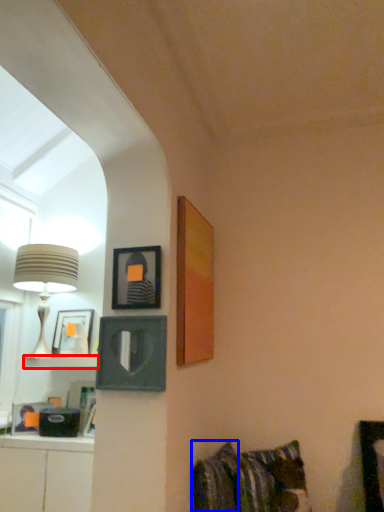
Question: Which object appears farthest to the camera in this image, shelf (highlighted by a red box) or pillow (highlighted by a blue box)?

Choices:
 (A) shelf
 (B) pillow

Answer: (A)